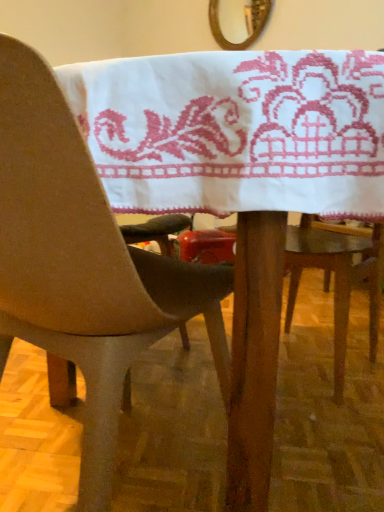
What do you see at coordinates (245, 21) in the screenshot? Image resolution: width=384 pixels, height=512 pixels. I see `wooden frame mirror at upper center` at bounding box center [245, 21].

What is the approximate width of wooden frame mirror at upper center?

2.55 inches.

The width and height of the screenshot is (384, 512). What are the coordinates of `wooden frame mirror at upper center` in the screenshot? It's located at (245, 21).

What do you see at coordinates (83, 266) in the screenshot?
I see `matte plastic chair at center` at bounding box center [83, 266].

What is the approximate width of matte plastic chair at center?

21.38 inches.

What are the coordinates of `matte plastic chair at center` in the screenshot? It's located at (83, 266).

This screenshot has height=512, width=384. What are the coordinates of `wooden frame mirror at upper center` in the screenshot? It's located at (245, 21).

Does wooden frame mirror at upper center appear on the right side of matte plastic chair at center?

Correct, you'll find wooden frame mirror at upper center to the right of matte plastic chair at center.

Considering their positions, is wooden frame mirror at upper center located in front of or behind matte plastic chair at center?

wooden frame mirror at upper center is positioned farther from the viewer than matte plastic chair at center.

Is point (227, 44) less distant than point (13, 94)?

No, (227, 44) is behind (13, 94).

From the image's perspective, is wooden frame mirror at upper center above or below matte plastic chair at center?

Clearly, from the image's perspective, wooden frame mirror at upper center is above matte plastic chair at center.

From a real-world perspective, who is located lower, wooden frame mirror at upper center or matte plastic chair at center?

In real-world perspective, matte plastic chair at center is lower.

Is wooden frame mirror at upper center thinner than matte plastic chair at center?

Indeed, wooden frame mirror at upper center has a lesser width compared to matte plastic chair at center.

Who is taller, wooden frame mirror at upper center or matte plastic chair at center?

matte plastic chair at center is taller.

Is wooden frame mirror at upper center smaller than matte plastic chair at center?

Correct, wooden frame mirror at upper center occupies less space than matte plastic chair at center.

Would you say matte plastic chair at center is part of wooden frame mirror at upper center's contents?

No, matte plastic chair at center is not a part of wooden frame mirror at upper center.

Is wooden frame mirror at upper center not close to matte plastic chair at center?

Indeed, wooden frame mirror at upper center is not near matte plastic chair at center.

Is wooden frame mirror at upper center oriented away from matte plastic chair at center?

No, wooden frame mirror at upper center's orientation is not away from matte plastic chair at center.

Find the location of `mirror located above the matte plastic chair at center (from the image's perspective)`. mirror located above the matte plastic chair at center (from the image's perspective) is located at coordinates (245, 21).

Considering the relative positions of matte plastic chair at center and wooden frame mirror at upper center in the image provided, is matte plastic chair at center to the right of wooden frame mirror at upper center from the viewer's perspective?

No.

Is matte plastic chair at center further to camera compared to wooden frame mirror at upper center?

That is False.

Does point (76, 335) lie behind point (268, 11)?

No.

From the image's perspective, is matte plastic chair at center on wooden frame mirror at upper center?

No.

From a real-world perspective, between matte plastic chair at center and wooden frame mirror at upper center, who is vertically higher?

wooden frame mirror at upper center, from a real-world perspective.

Which object is wider, matte plastic chair at center or wooden frame mirror at upper center?

With larger width is matte plastic chair at center.

Who is shorter, matte plastic chair at center or wooden frame mirror at upper center?

wooden frame mirror at upper center is shorter.

Can you confirm if matte plastic chair at center is bigger than wooden frame mirror at upper center?

Indeed, matte plastic chair at center has a larger size compared to wooden frame mirror at upper center.

Would you say wooden frame mirror at upper center is part of matte plastic chair at center's contents?

No, wooden frame mirror at upper center is not surrounded by matte plastic chair at center.

Are matte plastic chair at center and wooden frame mirror at upper center far apart?

Yes.

Could you tell me if matte plastic chair at center is facing wooden frame mirror at upper center?

No, matte plastic chair at center is not oriented towards wooden frame mirror at upper center.

What's the angular difference between matte plastic chair at center and wooden frame mirror at upper center's facing directions?

matte plastic chair at center and wooden frame mirror at upper center are facing 167 degrees away from each other.

The width and height of the screenshot is (384, 512). In the image, there is a matte plastic chair at center. Identify the location of mirror above it (from the image's perspective). (245, 21).

Locate an element on the screen. The height and width of the screenshot is (512, 384). mirror located on the right of matte plastic chair at center is located at coordinates (245, 21).

Where is `chair lying below the wooden frame mirror at upper center (from the image's perspective)`? chair lying below the wooden frame mirror at upper center (from the image's perspective) is located at coordinates [x=83, y=266].